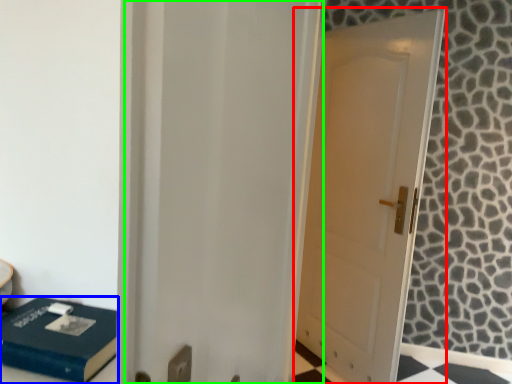
Question: Which object is the farthest from door (highlighted by a red box)? Choose among these: box (highlighted by a blue box) or screen door (highlighted by a green box).

Choices:
 (A) box
 (B) screen door

Answer: (A)